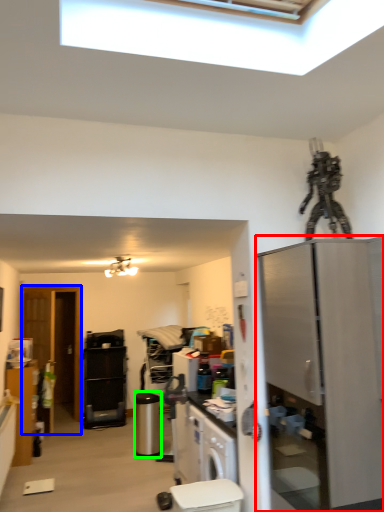
Question: Estimate the real-world distances between objects in this image. Which object is farther from refrigerator (highlighted by a red box), glass door (highlighted by a blue box) or appliance (highlighted by a green box)?

Choices:
 (A) glass door
 (B) appliance

Answer: (A)